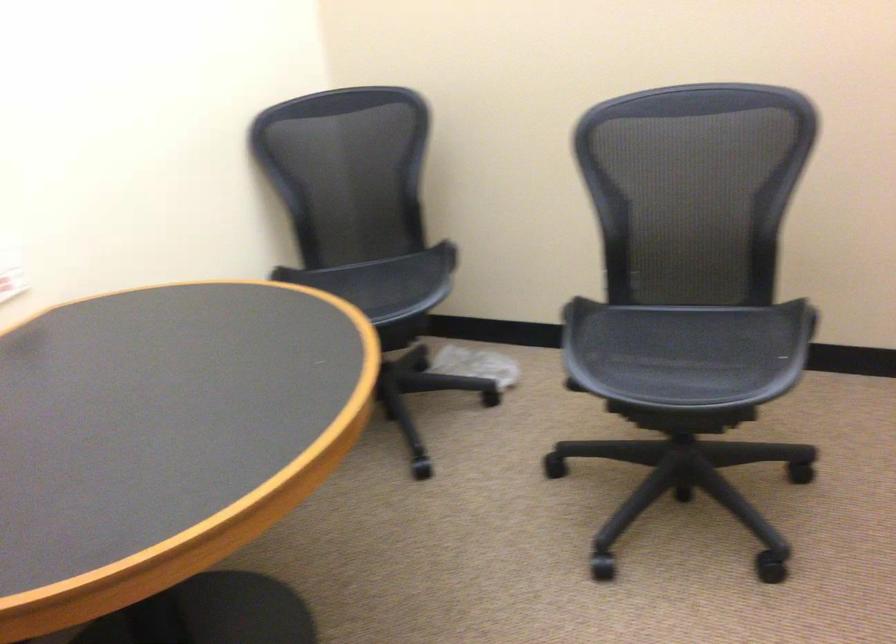
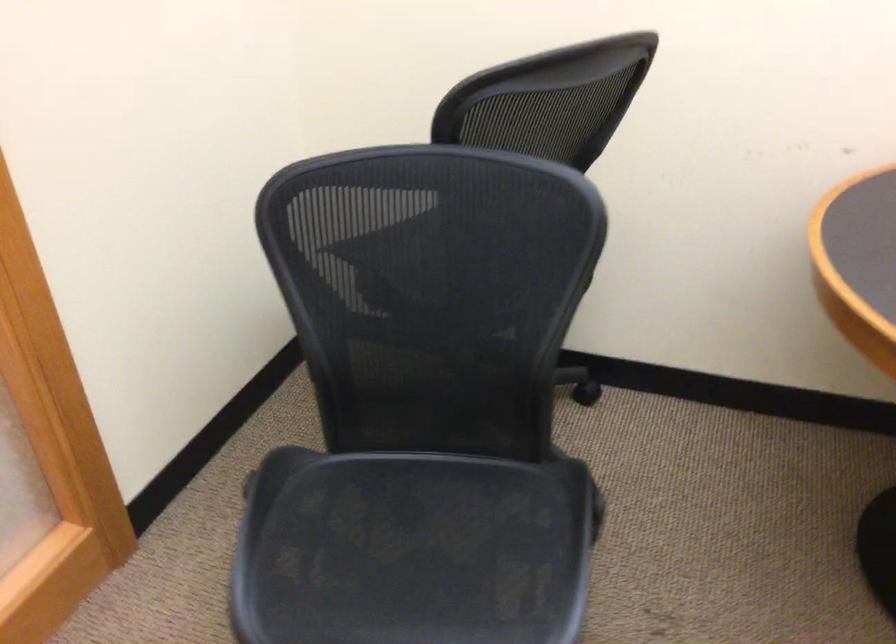
The images are taken continuously from a first-person perspective. In which direction is your viewpoint rotating?

The camera rotated toward left-down.